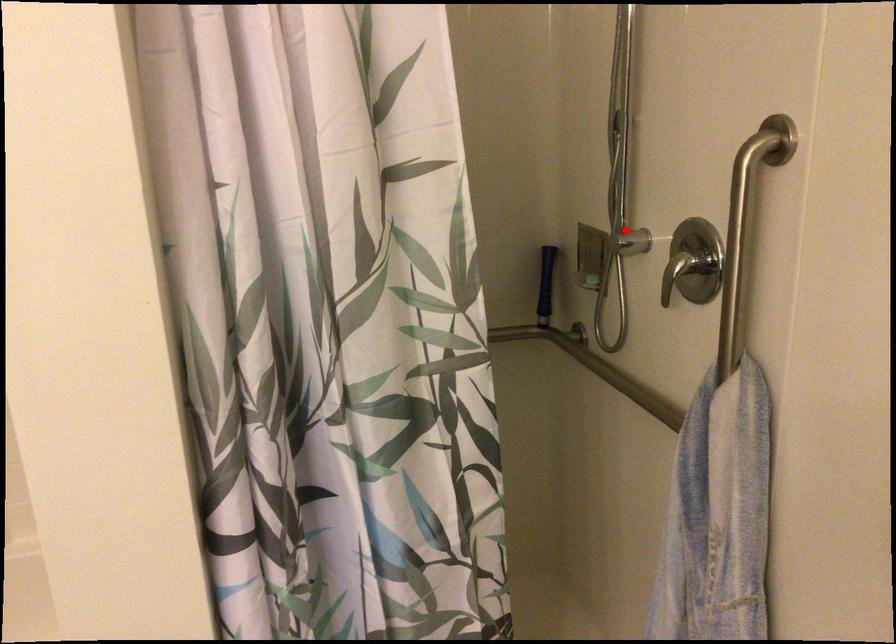
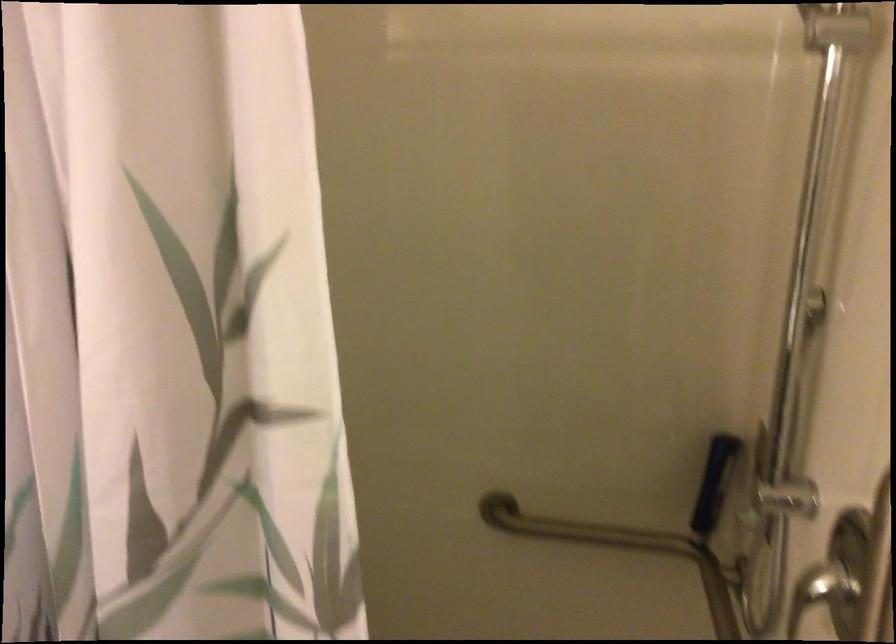
Locate, in the second image, the point that corresponds to the highlighted location in the first image.

(776, 488)